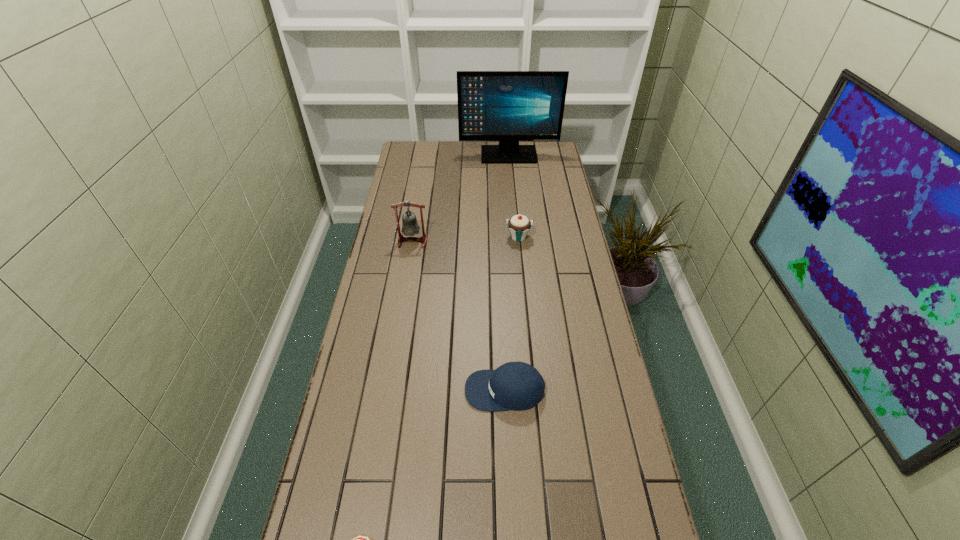
I want to click on vacant space located on the front-facing side of the baseball cap, so click(348, 390).

Find the location of `object that is at the far edge`. object that is at the far edge is located at coordinates (507, 106).

I want to click on object located in the left edge section of the desktop, so click(x=410, y=227).

You are a GUI agent. You are given a task and a screenshot of the screen. Output one action in this format:
    pyautogui.click(x=<x>, y=<y>)
    Task: Click on the object that is at the right edge
    
    Given the screenshot: What is the action you would take?
    pyautogui.click(x=507, y=106)

The height and width of the screenshot is (540, 960). I want to click on object that is at the far right corner, so click(x=507, y=106).

In order to click on vacant space at the far edge of the desktop in this screenshot , I will do `click(448, 157)`.

What are the coordinates of `vacant position at the left edge of the desktop` in the screenshot? It's located at (364, 327).

At what (x,y) coordinates should I click in order to perform the action: click on blank area at the right edge. Please return your answer as a coordinate pair (x, y). This screenshot has height=540, width=960. Looking at the image, I should click on (589, 288).

Where is `vacant space at the far left corner`? vacant space at the far left corner is located at coordinates (410, 146).

Locate an element on the screen. The image size is (960, 540). free location at the far right corner is located at coordinates point(541,150).